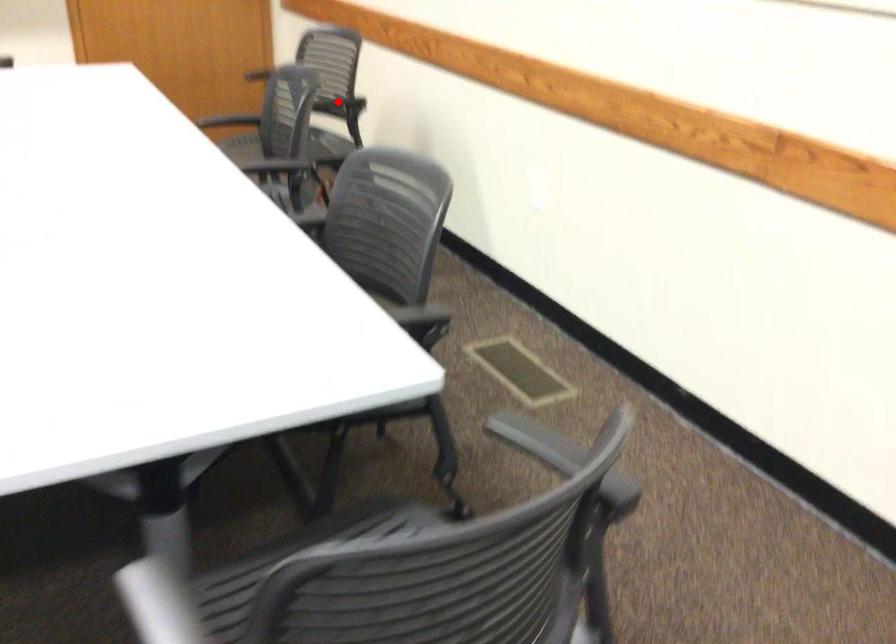
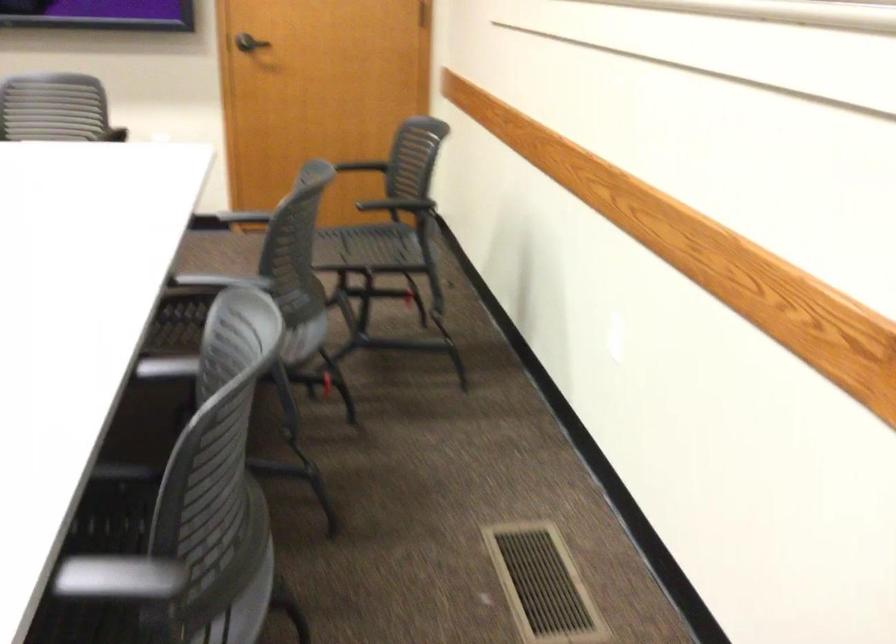
The point at the highlighted location is marked in the first image. Where is the corresponding point in the second image?

(398, 205)